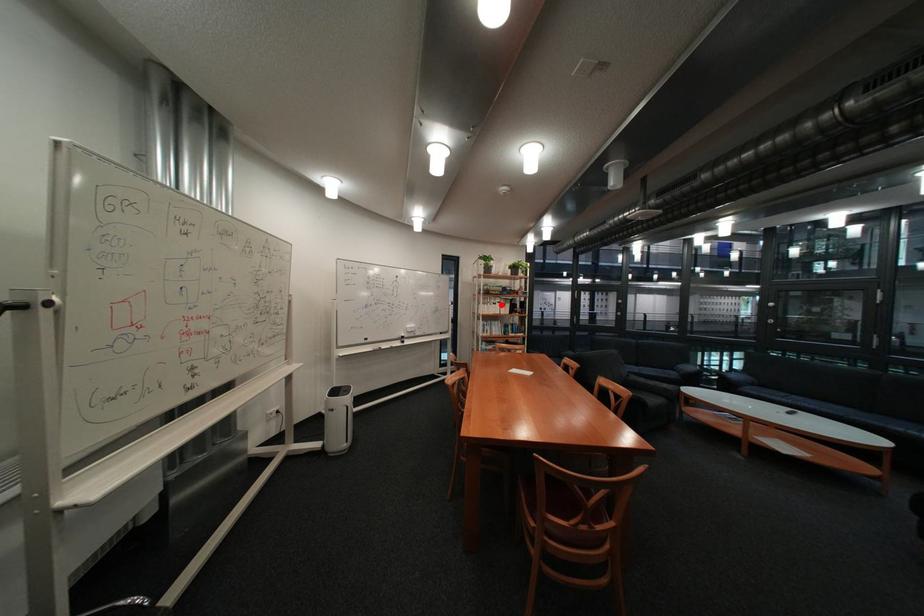
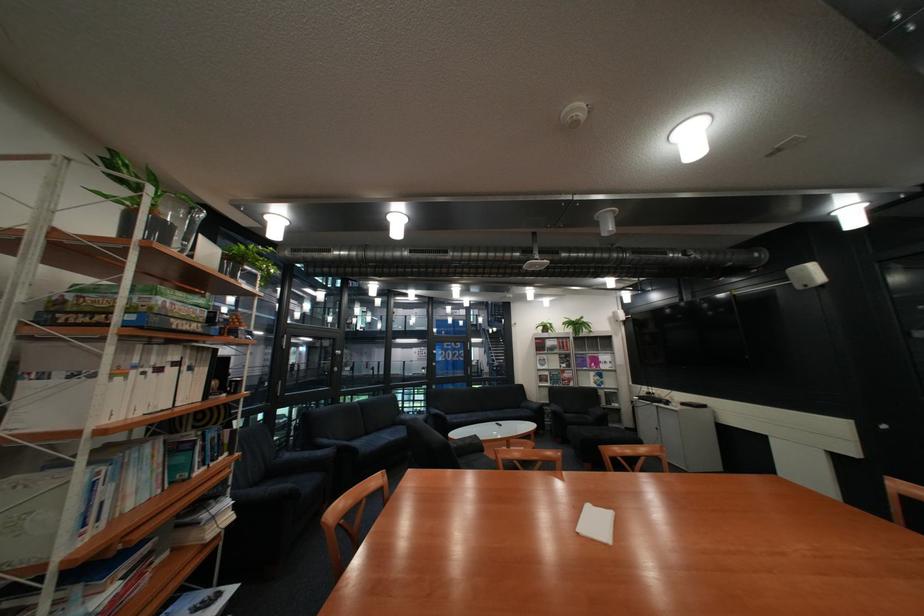
Locate, in the second image, the point that corresponds to the highlighted location in the first image.

(134, 379)